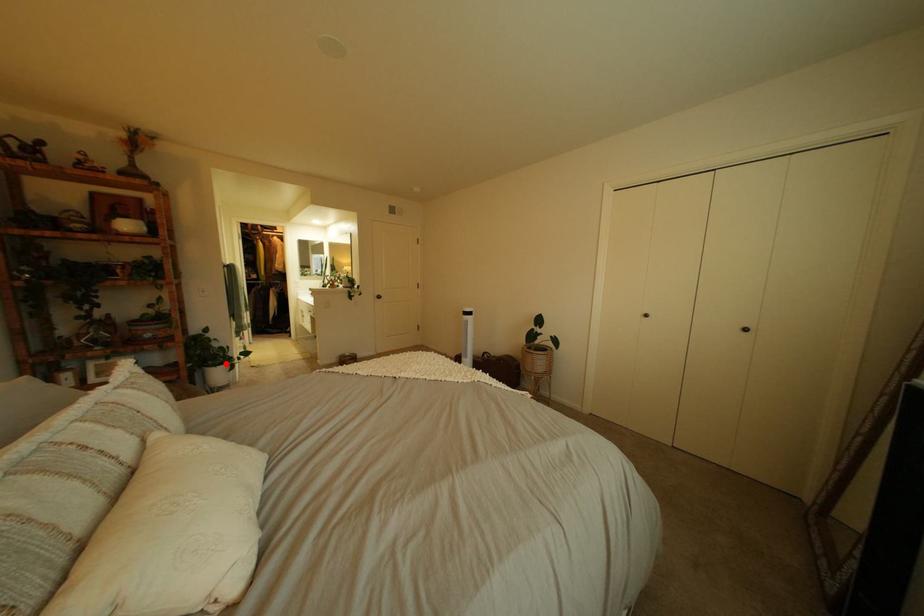
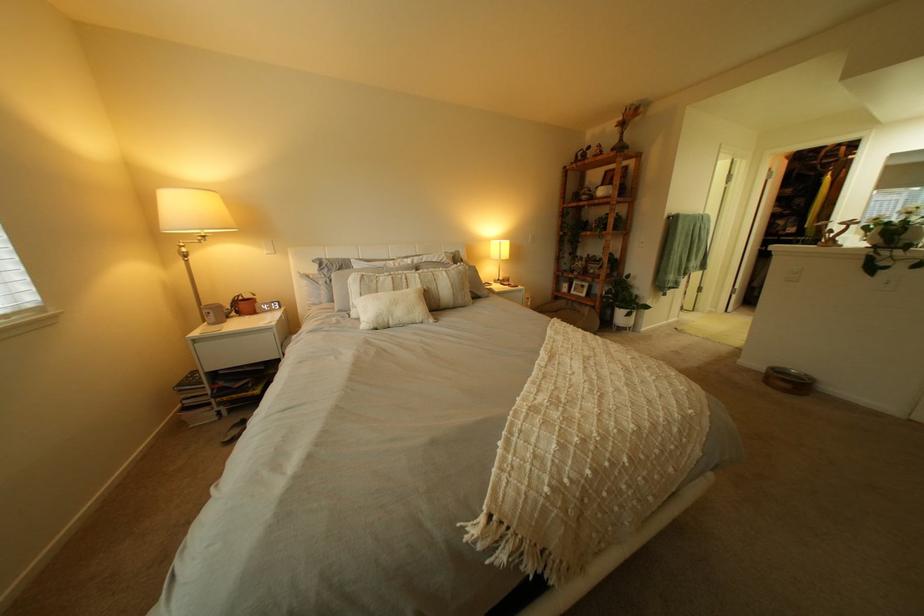
Question: A red point is marked in image1. In image2, is the corresponding 3D point closer to the camera or farther? Reply with the corresponding letter.

Choices:
 (A) The corresponding 3D point is closer.
 (B) The corresponding 3D point is farther.

Answer: (A)